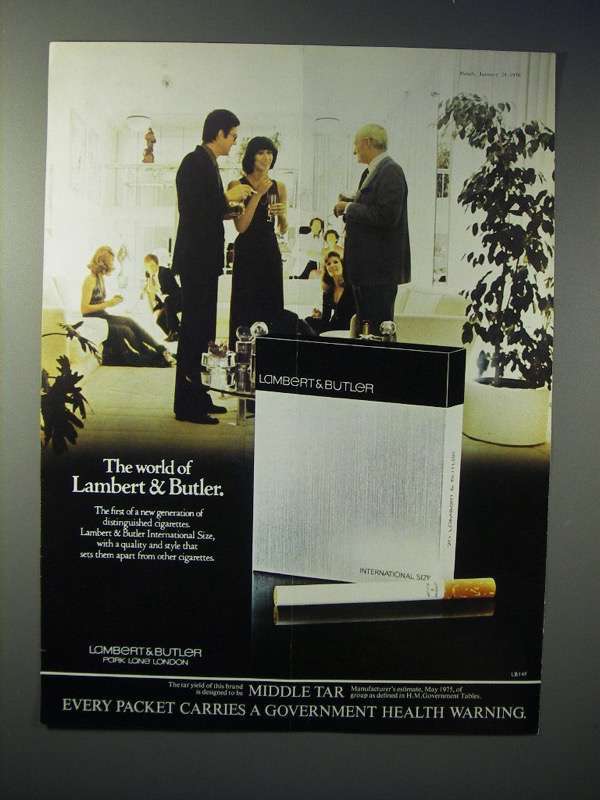
Where is `pot`? The width and height of the screenshot is (600, 800). pot is located at coordinates (510, 420).